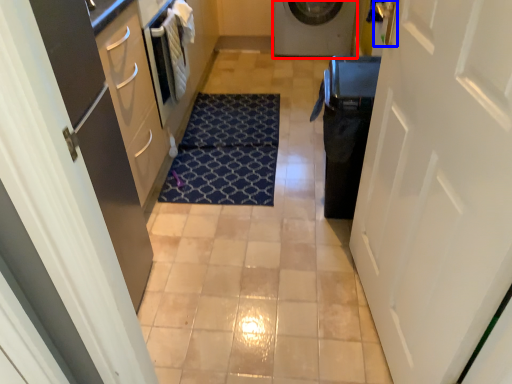
Question: Which of the following is the closest to the observer, washing machine (highlighted by a red box) or door handle (highlighted by a blue box)?

Choices:
 (A) washing machine
 (B) door handle

Answer: (B)